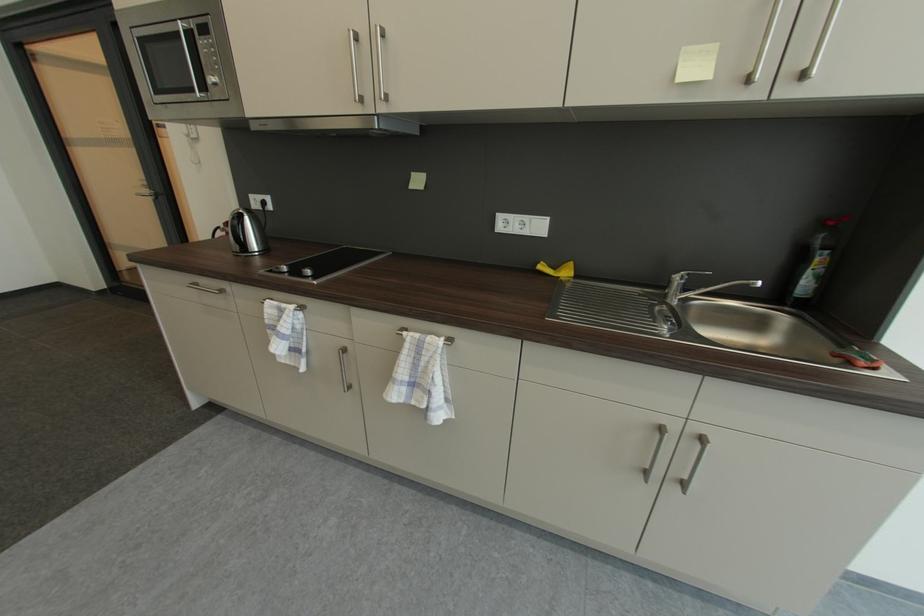
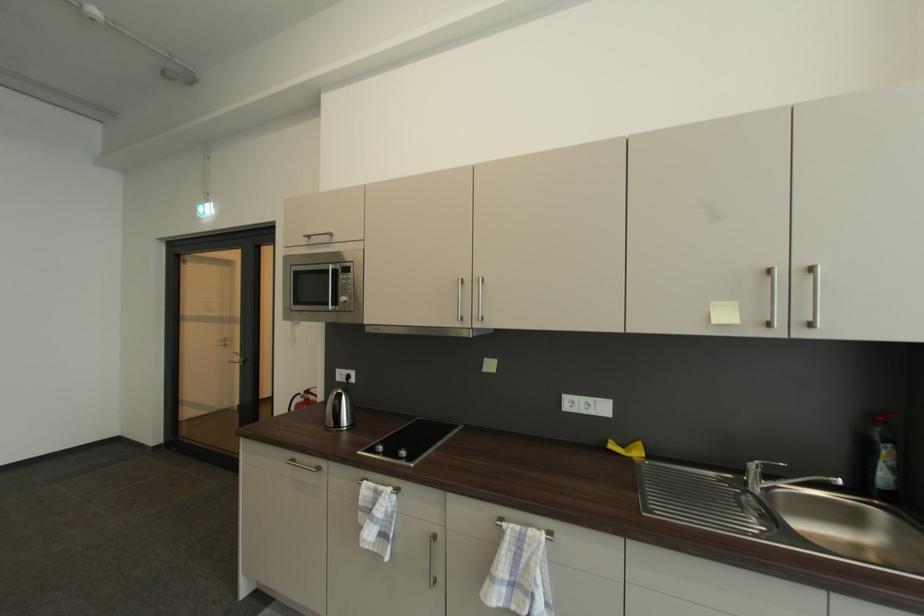
Question: Based on the continuous images, in which direction is the camera rotating? Reply with the corresponding letter.

Choices:
 (A) Left
 (B) Right
 (C) Up
 (D) Down

Answer: (C)